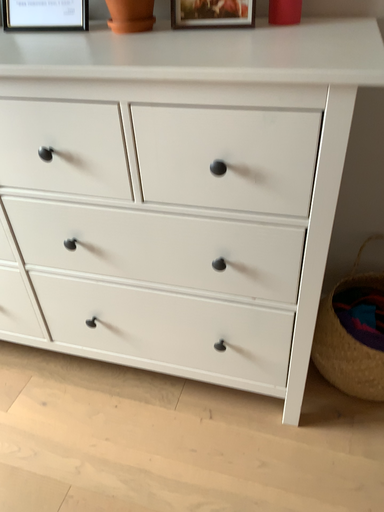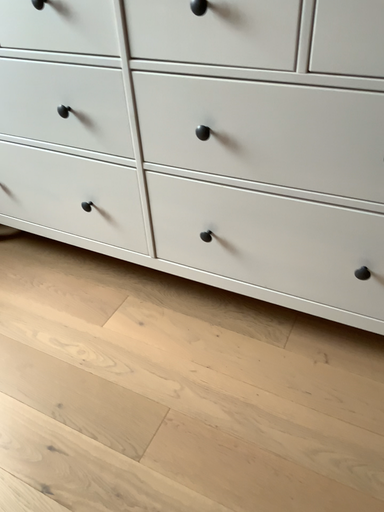
Question: How did the camera likely rotate when shooting the video?

Choices:
 (A) rotated right
 (B) rotated left

Answer: (B)